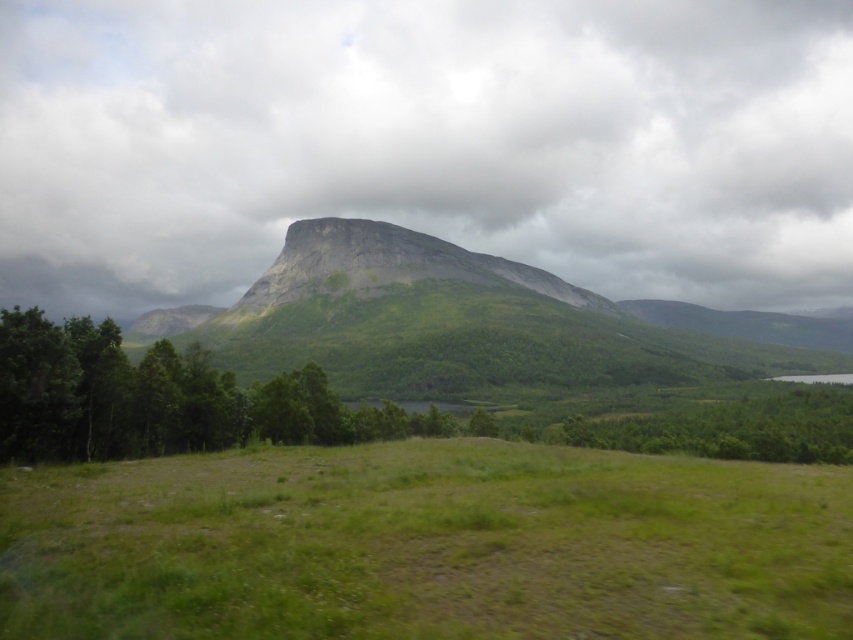
You are hiking towards the large mountain and notice the cloudy gray rock at upper center and the green leafy tree at center. Which object would you encounter first on your path?

You would encounter the cloudy gray rock at upper center first because it is closer to you than the green leafy tree at center, which is further away.

You are standing on the green grassy field at center and want to climb up to the green grassy mountain at center. Considering the height difference, will you need to exert more effort compared to walking on flat ground?

The green grassy field at center has a lesser height compared to the green grassy mountain at center, so climbing up the green grassy mountain at center will require more effort than walking on flat ground due to the elevation difference.

You are standing at the origin point in the image. Which direction should you walk to reach the green grassy field at center?

The green grassy field at center is located at point 0.852 on the x axis and 0.501 on the y axis. Since you are at the origin point, you should walk towards the positive x direction to reach it.